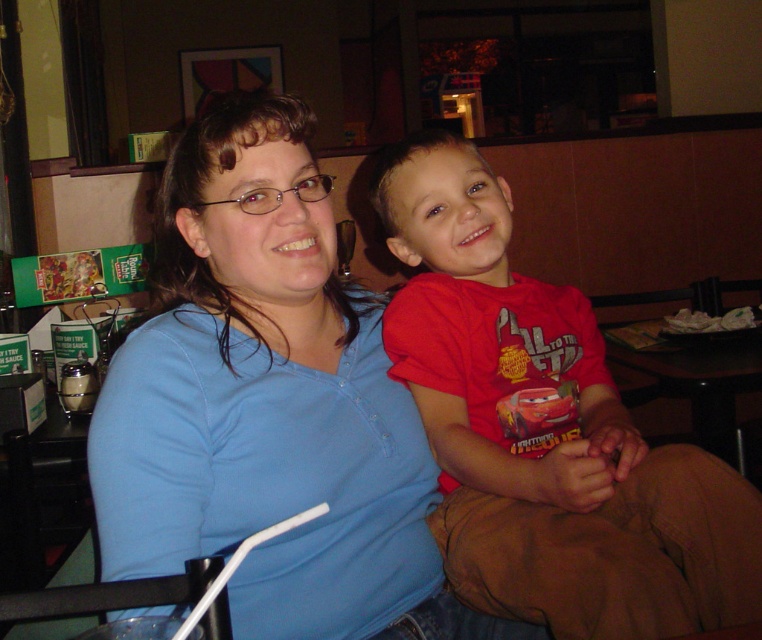
Looking at this image, you are taking a photo of two people sitting at a table in a dimly lit restaurant. You notice two points in the image with coordinates point (325, 356) and point (730, 524). Which point is closer to the camera?

Point (325, 356) is closer to the camera than point (730, 524).

You are a photographer trying to capture a group photo of the blue cotton shirt at center and the red cotton shirt at center. Since you want everyone to be in focus, you need to know which shirt is taller. Which one is taller?

The blue cotton shirt at center is taller than the red cotton shirt at center according to the description.